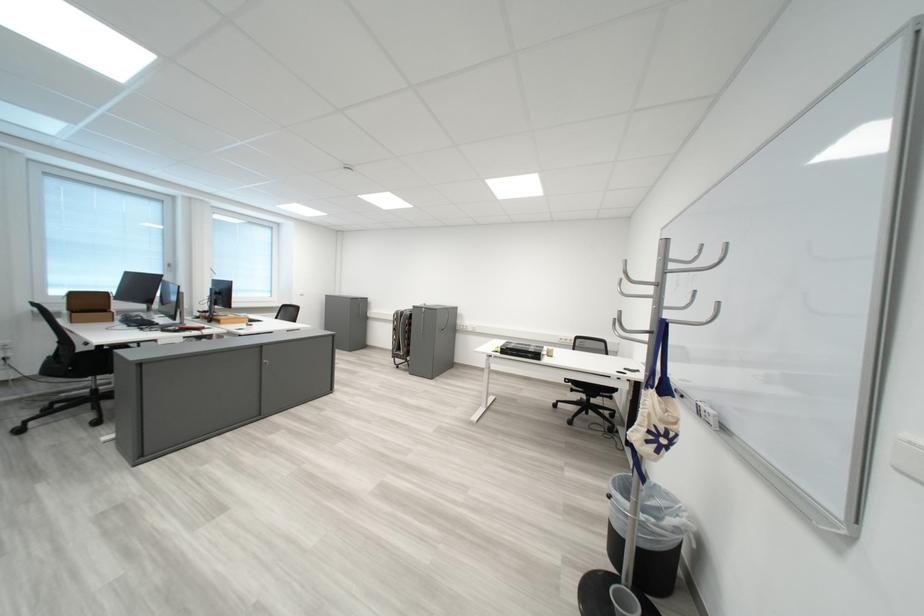
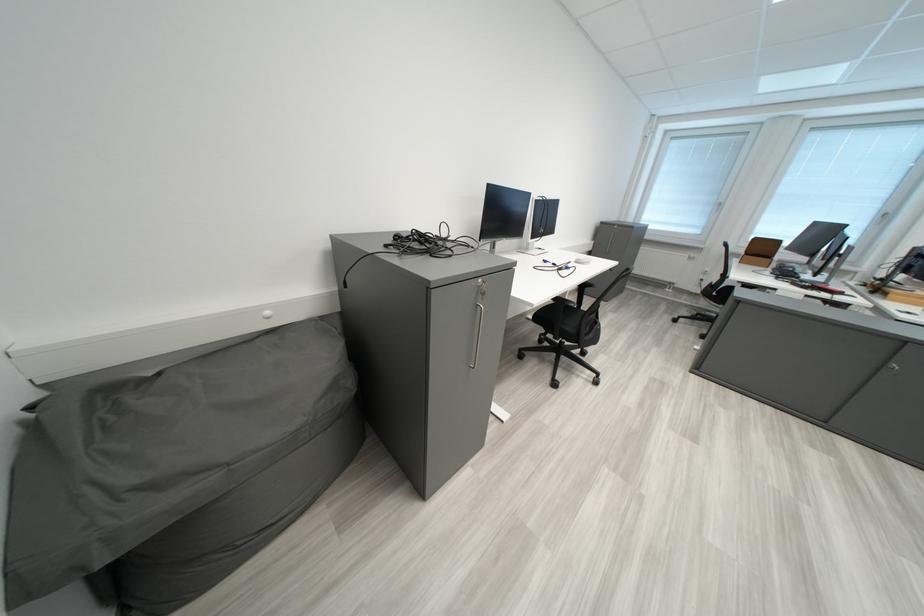
The point at (89, 296) is marked in the first image. Where is the corresponding point in the second image?

(769, 241)